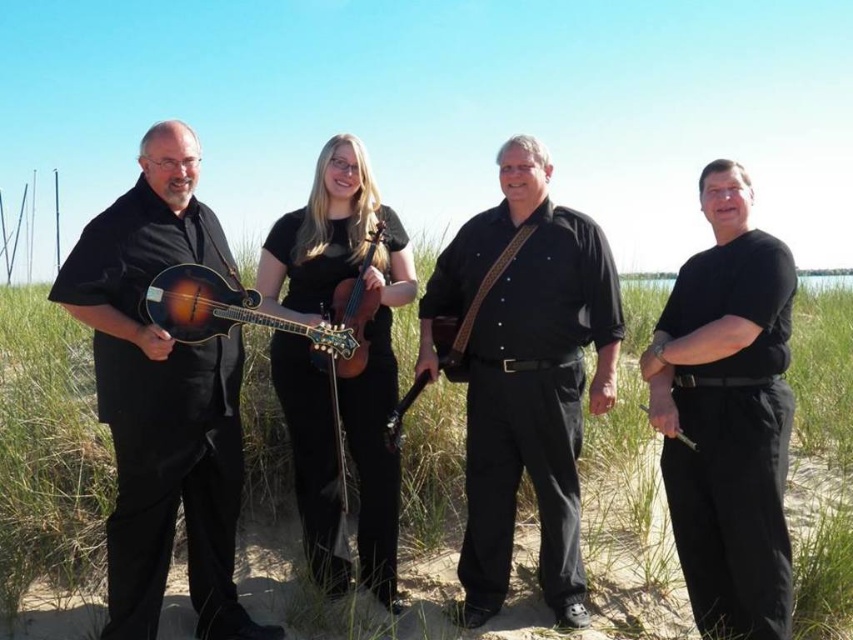
Question: Which point is farther from the camera taking this photo?

Choices:
 (A) (271, 241)
 (B) (640, 410)
 (C) (776, 451)

Answer: (B)

Question: Can you confirm if satin wood mandolin at left is positioned to the right of black matte pants at right?

Choices:
 (A) yes
 (B) no

Answer: (B)

Question: Among these points, which one is farthest from the camera?

Choices:
 (A) [x=640, y=406]
 (B) [x=322, y=336]
 (C) [x=136, y=573]
 (D) [x=689, y=576]

Answer: (A)

Question: Can you confirm if black matte violin at center is smaller than wooden guitar at center?

Choices:
 (A) no
 (B) yes

Answer: (A)

Question: Can you confirm if black matte violin at center is positioned below wooden guitar at center?

Choices:
 (A) yes
 (B) no

Answer: (B)

Question: Which of the following is the farthest from the observer?

Choices:
 (A) black leather guitar at center
 (B) satin wood mandolin at left

Answer: (A)